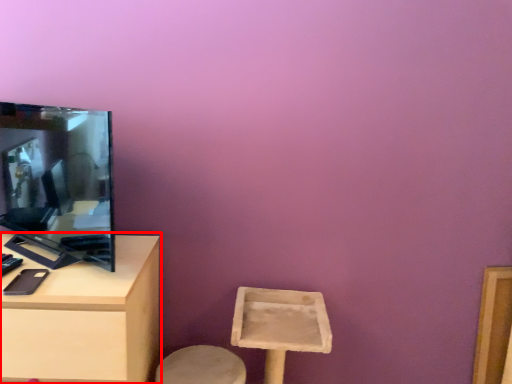
Question: Where is table (annotated by the red box) located in relation to television in the image?

Choices:
 (A) right
 (B) left

Answer: (B)